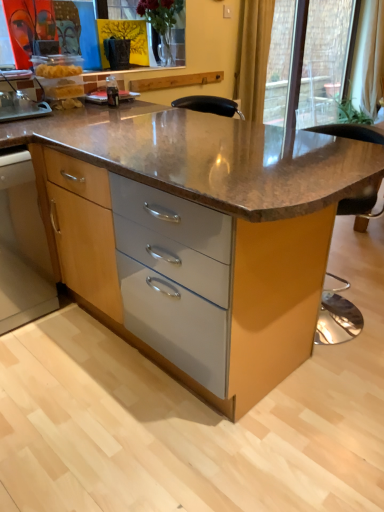
Question: Is there a large distance between brown polished granite table at center and yellow fabric curtain at upper right?

Choices:
 (A) no
 (B) yes

Answer: (B)

Question: From the image's perspective, is brown polished granite table at center above yellow fabric curtain at upper right?

Choices:
 (A) no
 (B) yes

Answer: (A)

Question: Is brown polished granite table at center positioned behind yellow fabric curtain at upper right?

Choices:
 (A) no
 (B) yes

Answer: (A)

Question: Considering the relative sizes of brown polished granite table at center and yellow fabric curtain at upper right in the image provided, is brown polished granite table at center wider than yellow fabric curtain at upper right?

Choices:
 (A) no
 (B) yes

Answer: (B)

Question: Is the depth of brown polished granite table at center less than that of yellow fabric curtain at upper right?

Choices:
 (A) no
 (B) yes

Answer: (B)

Question: From a real-world perspective, is wooden cabinet at lower left positioned above or below transparent glass door at upper right?

Choices:
 (A) above
 (B) below

Answer: (B)

Question: Do you think wooden cabinet at lower left is within transparent glass door at upper right, or outside of it?

Choices:
 (A) inside
 (B) outside

Answer: (B)

Question: Is wooden cabinet at lower left wider or thinner than transparent glass door at upper right?

Choices:
 (A) thin
 (B) wide

Answer: (B)

Question: Is wooden cabinet at lower left bigger or smaller than transparent glass door at upper right?

Choices:
 (A) big
 (B) small

Answer: (B)

Question: Relative to wooden cabinet at lower left, is yellow fabric curtain at upper right in front or behind?

Choices:
 (A) front
 (B) behind

Answer: (B)

Question: From their relative heights in the image, would you say yellow fabric curtain at upper right is taller or shorter than wooden cabinet at lower left?

Choices:
 (A) short
 (B) tall

Answer: (B)

Question: From a real-world perspective, is yellow fabric curtain at upper right positioned above or below wooden cabinet at lower left?

Choices:
 (A) above
 (B) below

Answer: (A)

Question: In terms of width, does yellow fabric curtain at upper right look wider or thinner when compared to wooden cabinet at lower left?

Choices:
 (A) wide
 (B) thin

Answer: (B)

Question: In terms of size, does brown polished granite table at center appear bigger or smaller than yellow fabric curtain at upper right?

Choices:
 (A) small
 (B) big

Answer: (B)

Question: Which is correct: brown polished granite table at center is inside yellow fabric curtain at upper right, or outside of it?

Choices:
 (A) outside
 (B) inside

Answer: (A)